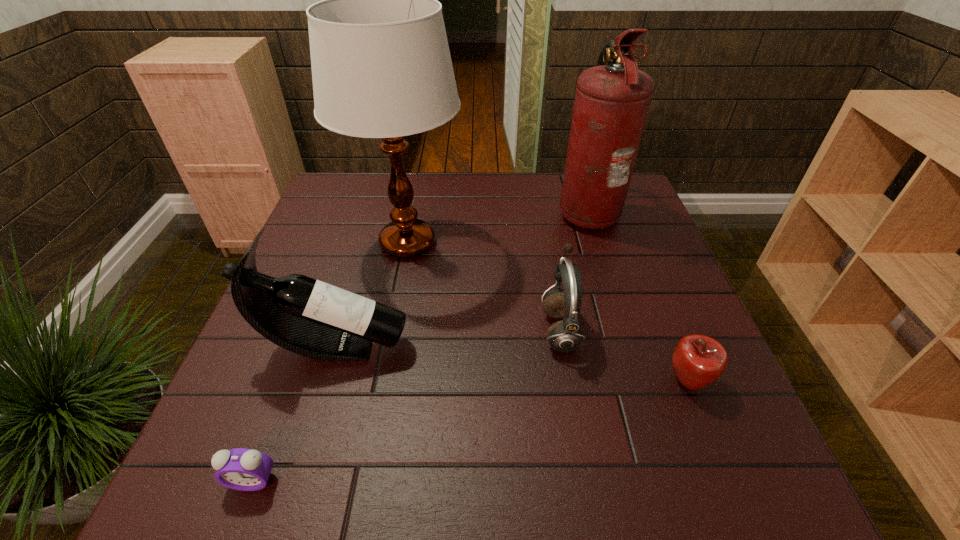
I want to click on table lamp, so click(x=381, y=66).

You are a GUI agent. You are given a task and a screenshot of the screen. Output one action in this format:
    pyautogui.click(x=<x>, y=<y>)
    Task: Click on the fire extinguisher
    The height and width of the screenshot is (540, 960).
    Given the screenshot: What is the action you would take?
    pyautogui.click(x=612, y=100)

This screenshot has width=960, height=540. Find the location of `the fourth shortest object`. the fourth shortest object is located at coordinates (306, 316).

The image size is (960, 540). In order to click on the fourth tallest object in this screenshot , I will do pos(566,335).

Locate an element on the screen. The width and height of the screenshot is (960, 540). the third object from right to left is located at coordinates (566, 335).

Find the location of a particular element. The image size is (960, 540). the fifth tallest object is located at coordinates (698, 360).

At what (x,y) coordinates should I click in order to perform the action: click on apple. Please return your answer as a coordinate pair (x, y). Image resolution: width=960 pixels, height=540 pixels. Looking at the image, I should click on (698, 360).

What are the coordinates of `alarm clock` in the screenshot? It's located at (242, 469).

In order to click on the shortest object in this screenshot , I will do `click(242, 469)`.

Locate an element on the screen. The image size is (960, 540). vacant space located 0.180m on the back of the table lamp is located at coordinates (420, 179).